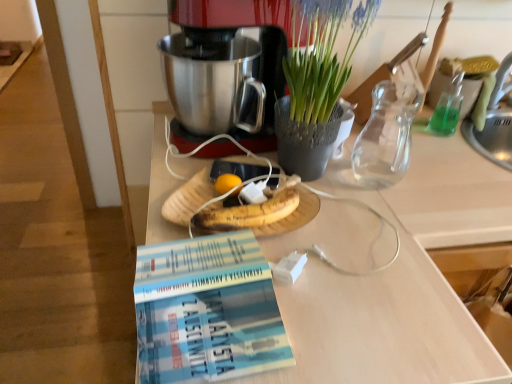
Question: Would you say blue paperback book at lower center contains transparent glass vase at upper right?

Choices:
 (A) no
 (B) yes

Answer: (A)

Question: From the image's perspective, would you say blue paperback book at lower center is positioned over transparent glass vase at upper right?

Choices:
 (A) yes
 (B) no

Answer: (B)

Question: Is blue paperback book at lower center aimed at transparent glass vase at upper right?

Choices:
 (A) yes
 (B) no

Answer: (B)

Question: Can you confirm if blue paperback book at lower center is taller than transparent glass vase at upper right?

Choices:
 (A) yes
 (B) no

Answer: (B)

Question: Would you say blue paperback book at lower center is a long distance from transparent glass vase at upper right?

Choices:
 (A) no
 (B) yes

Answer: (A)

Question: Considering the relative sizes of blue paperback book at lower center and transparent glass vase at upper right in the image provided, is blue paperback book at lower center wider than transparent glass vase at upper right?

Choices:
 (A) yes
 (B) no

Answer: (A)

Question: From the image's perspective, is blue paperback book at lower center beneath metallic silver coffee maker at center?

Choices:
 (A) yes
 (B) no

Answer: (A)

Question: Considering the relative sizes of blue paperback book at lower center and metallic silver coffee maker at center in the image provided, is blue paperback book at lower center smaller than metallic silver coffee maker at center?

Choices:
 (A) no
 (B) yes

Answer: (B)

Question: Is blue paperback book at lower center outside metallic silver coffee maker at center?

Choices:
 (A) no
 (B) yes

Answer: (B)

Question: From the image's perspective, is blue paperback book at lower center above metallic silver coffee maker at center?

Choices:
 (A) no
 (B) yes

Answer: (A)

Question: Is blue paperback book at lower center positioned with its back to metallic silver coffee maker at center?

Choices:
 (A) yes
 (B) no

Answer: (A)

Question: Is blue paperback book at lower center far away from metallic silver coffee maker at center?

Choices:
 (A) no
 (B) yes

Answer: (A)

Question: Is green textured vase at upper center at the right side of transparent glass vase at upper right?

Choices:
 (A) yes
 (B) no

Answer: (B)